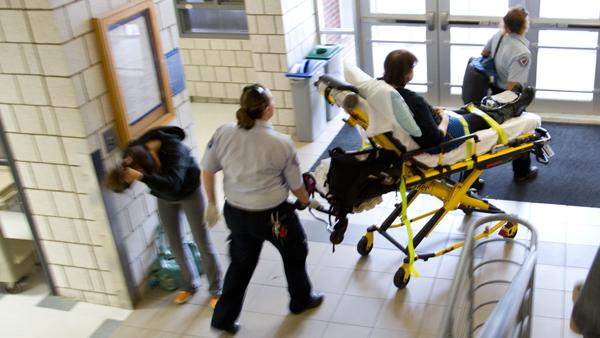
Where is `door`? The width and height of the screenshot is (600, 338). door is located at coordinates (445, 36), (420, 32).